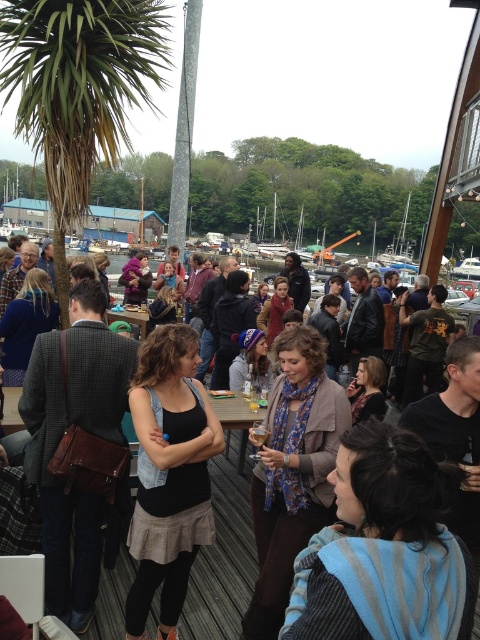
You are a photographer at the event and want to capture both the black denim tank top at center and the black leather jacket at center in the same frame. Which clothing item will appear taller in the photo?

The black leather jacket at center will appear taller in the photo since it is taller than the black denim tank top at center.

What is the color of the clothing item at the coordinates point (168, 474) in the image?

The point (168, 474) is on the black denim tank top at center, so the color is black.